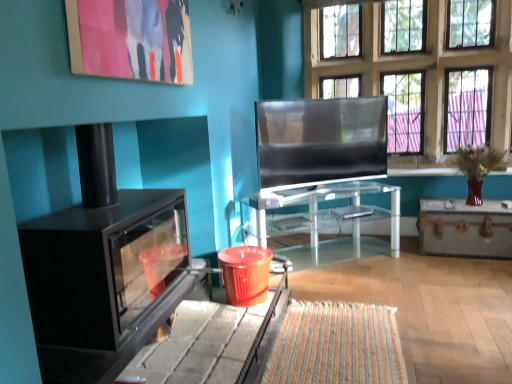
Locate an element on the screen. The image size is (512, 384). matte acrylic painting at upper left is located at coordinates (131, 39).

The width and height of the screenshot is (512, 384). Identify the location of glass paneled window at upper center. (420, 69).

Locate an element on the screen. The width and height of the screenshot is (512, 384). matte acrylic painting at upper left is located at coordinates (131, 39).

Measure the distance between matte acrylic painting at upper left and glass paneled window at upper center.

matte acrylic painting at upper left is 2.49 meters from glass paneled window at upper center.

Considering the sizes of matte acrylic painting at upper left and glass paneled window at upper center in the image, is matte acrylic painting at upper left taller or shorter than glass paneled window at upper center?

Clearly, matte acrylic painting at upper left is shorter compared to glass paneled window at upper center.

Are matte acrylic painting at upper left and glass paneled window at upper center beside each other?

matte acrylic painting at upper left and glass paneled window at upper center are clearly separated.

Considering the relative positions of matte acrylic painting at upper left and glass paneled window at upper center in the image provided, is matte acrylic painting at upper left to the left or to the right of glass paneled window at upper center?

Clearly, matte acrylic painting at upper left is on the left of glass paneled window at upper center in the image.

Considering the points (443, 251) and (350, 114), which point is behind, point (443, 251) or point (350, 114)?

The point (443, 251) is farther from the camera.

From the image's perspective, is metallic trunk at right, acting as the 1th table starting from the right, located beneath matte black tv at center?

Correct, metallic trunk at right, acting as the 1th table starting from the right, appears lower than matte black tv at center in the image.

Is metallic trunk at right, the second table when ordered from left to right, facing towards matte black tv at center?

No, metallic trunk at right, the second table when ordered from left to right, is not facing towards matte black tv at center.

Considering the positions of point (294, 132) and point (85, 11), is point (294, 132) closer or farther from the camera than point (85, 11)?

Clearly, point (294, 132) is more distant from the camera than point (85, 11).

From the picture: How different are the orientations of matte black tv at center and matte acrylic painting at upper left in degrees?

The angle between the facing direction of matte black tv at center and the facing direction of matte acrylic painting at upper left is 54.3 degrees.

Looking at this image, considering the relative sizes of matte black tv at center and matte acrylic painting at upper left in the image provided, is matte black tv at center wider than matte acrylic painting at upper left?

Yes, matte black tv at center is wider than matte acrylic painting at upper left.

Is matte black tv at center positioned in front of matte acrylic painting at upper left?

No, matte black tv at center is further to the viewer.

Which of these two, glass paneled window at upper center or matte black tv at center, is bigger?

With larger size is glass paneled window at upper center.

The height and width of the screenshot is (384, 512). In order to click on window located above the matte black tv at center (from the image's perspective) in this screenshot , I will do `click(420, 69)`.

Do you think glass paneled window at upper center is within matte black tv at center, or outside of it?

glass paneled window at upper center is outside matte black tv at center.

Considering the sizes of objects glass paneled window at upper center and matte black tv at center in the image provided, who is wider, glass paneled window at upper center or matte black tv at center?

glass paneled window at upper center is wider.

What's the angular difference between transparent glass table at center, the 1th table viewed from the left, and metallic trunk at right, acting as the 1th table starting from the right,'s facing directions?

There is a 41.1-degree angle between the facing directions of transparent glass table at center, the 1th table viewed from the left, and metallic trunk at right, acting as the 1th table starting from the right.

Considering the relative sizes of transparent glass table at center, the second table positioned from the right, and metallic trunk at right, acting as the 1th table starting from the right, in the image provided, is transparent glass table at center, the second table positioned from the right, wider than metallic trunk at right, acting as the 1th table starting from the right,?

Correct, the width of transparent glass table at center, the second table positioned from the right, exceeds that of metallic trunk at right, acting as the 1th table starting from the right.

Would you say transparent glass table at center, the second table positioned from the right, is inside or outside metallic trunk at right, acting as the 1th table starting from the right?

transparent glass table at center, the second table positioned from the right, is spatially situated outside metallic trunk at right, acting as the 1th table starting from the right.

Is there a large distance between transparent glass table at center, the second table positioned from the right, and metallic trunk at right, the second table when ordered from left to right?

No, transparent glass table at center, the second table positioned from the right, is not far from metallic trunk at right, the second table when ordered from left to right.

Is transparent glass table at center, the 1th table viewed from the left, touching matte acrylic painting at upper left?

No.

Could matte acrylic painting at upper left be considered to be inside transparent glass table at center, the second table positioned from the right?

No, matte acrylic painting at upper left is located outside of transparent glass table at center, the second table positioned from the right.

In terms of height, does transparent glass table at center, the second table positioned from the right, look taller or shorter compared to matte black tv at center?

In the image, transparent glass table at center, the second table positioned from the right, appears to be shorter than matte black tv at center.

Which object is further away from the camera taking this photo, transparent glass table at center, the second table positioned from the right, or matte black tv at center?

matte black tv at center is further from the camera.

Between transparent glass table at center, the second table positioned from the right, and matte black tv at center, which one has smaller width?

matte black tv at center is thinner.

Identify the location of television that appears above the transparent glass table at center, the second table positioned from the right (from a real-world perspective). The image size is (512, 384). (321, 140).

Where is `window below the matte acrylic painting at upper left (from a real-world perspective)`? window below the matte acrylic painting at upper left (from a real-world perspective) is located at coordinates (420, 69).

Identify the location of television above the metallic trunk at right, the second table when ordered from left to right (from the image's perspective). (321, 140).

Based on their spatial positions, is transparent glass table at center, the second table positioned from the right, or matte black tv at center further from matte acrylic painting at upper left?

Based on the image, transparent glass table at center, the second table positioned from the right, appears to be further to matte acrylic painting at upper left.

Which object lies nearer to the anchor point metallic trunk at right, acting as the 1th table starting from the right, glass paneled window at upper center or matte black tv at center?

matte black tv at center is positioned closer to the anchor metallic trunk at right, acting as the 1th table starting from the right.

From the image, which object appears to be nearer to matte black tv at center, transparent glass table at center, the second table positioned from the right, or metallic trunk at right, the second table when ordered from left to right?

Based on the image, transparent glass table at center, the second table positioned from the right, appears to be nearer to matte black tv at center.

Looking at the image, which one is located closer to metallic trunk at right, the second table when ordered from left to right, matte acrylic painting at upper left or transparent glass table at center, the second table positioned from the right?

transparent glass table at center, the second table positioned from the right, lies closer to metallic trunk at right, the second table when ordered from left to right, than the other object.

Estimate the real-world distances between objects in this image. Which object is closer to black matte fireplace at left, matte black tv at center or matte acrylic painting at upper left?

matte acrylic painting at upper left lies closer to black matte fireplace at left than the other object.

Considering their positions, is glass paneled window at upper center positioned further to matte black tv at center than transparent glass table at center, the 1th table viewed from the left?

glass paneled window at upper center lies further to matte black tv at center than the other object.

When comparing their distances from matte black tv at center, does transparent glass table at center, the second table positioned from the right, or black matte fireplace at left seem further?

Result: Based on the image, black matte fireplace at left appears to be further to matte black tv at center.

Looking at this image, estimate the real-world distances between objects in this image. Which object is further from black matte fireplace at left, matte black tv at center or metallic trunk at right, acting as the 1th table starting from the right?

Among the two, metallic trunk at right, acting as the 1th table starting from the right, is located further to black matte fireplace at left.

I want to click on television located between matte acrylic painting at upper left and metallic trunk at right, the second table when ordered from left to right, in the left-right direction, so click(x=321, y=140).

Where is `table positioned between black matte fireplace at left and matte black tv at center from near to far`? table positioned between black matte fireplace at left and matte black tv at center from near to far is located at coordinates (323, 222).

Locate an element on the screen. The height and width of the screenshot is (384, 512). picture frame located between black matte fireplace at left and transparent glass table at center, the second table positioned from the right, in the depth direction is located at coordinates (131, 39).

You are a GUI agent. You are given a task and a screenshot of the screen. Output one action in this format:
    pyautogui.click(x=<x>, y=<y>)
    Task: Click on the picture frame between black matte fireplace at left and matte black tv at center in the front-back direction
    This screenshot has height=384, width=512.
    Given the screenshot: What is the action you would take?
    tap(131, 39)